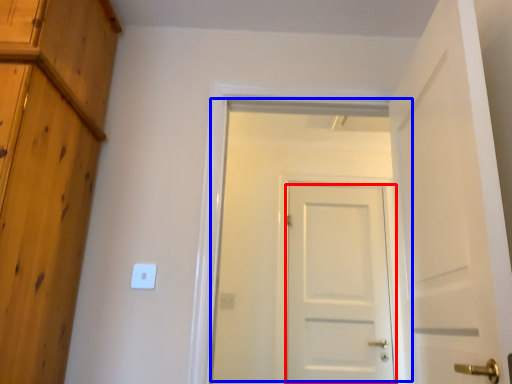
Question: Which object is closer to the camera taking this photo, door (highlighted by a red box) or door (highlighted by a blue box)?

Choices:
 (A) door
 (B) door

Answer: (B)